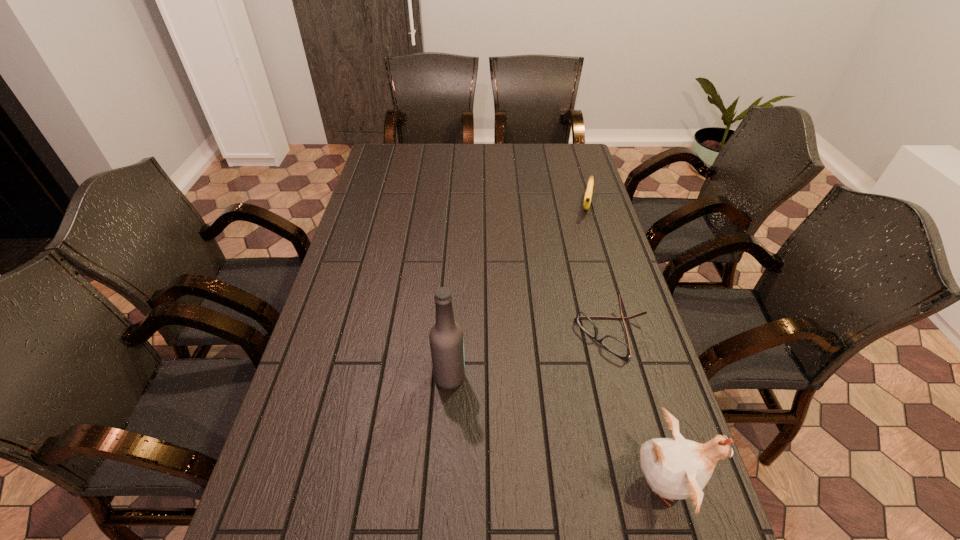
Image resolution: width=960 pixels, height=540 pixels. In order to click on the tallest object in this screenshot , I will do `click(446, 338)`.

Image resolution: width=960 pixels, height=540 pixels. In order to click on beer bottle in this screenshot , I will do `click(446, 338)`.

Where is `the shortest object`? the shortest object is located at coordinates (613, 344).

Where is `spectacles`? The image size is (960, 540). spectacles is located at coordinates (613, 344).

Locate an element on the screen. This screenshot has height=540, width=960. banana is located at coordinates (588, 194).

Locate an element on the screen. Image resolution: width=960 pixels, height=540 pixels. the third tallest object is located at coordinates (588, 194).

Identify the location of vacant space located on the side of the leftmost object with the label. This screenshot has height=540, width=960. (489, 377).

At what (x,y) coordinates should I click in order to perform the action: click on vacant space located on the front-facing side of the spectacles. Please return your answer as a coordinate pair (x, y). This screenshot has width=960, height=540. Looking at the image, I should click on pos(565,370).

Locate an element on the screen. This screenshot has width=960, height=540. vacant space positioned 0.390m on the front-facing side of the spectacles is located at coordinates (474, 444).

This screenshot has height=540, width=960. Find the location of `free space located 0.180m on the front-facing side of the spectacles`. free space located 0.180m on the front-facing side of the spectacles is located at coordinates (540, 390).